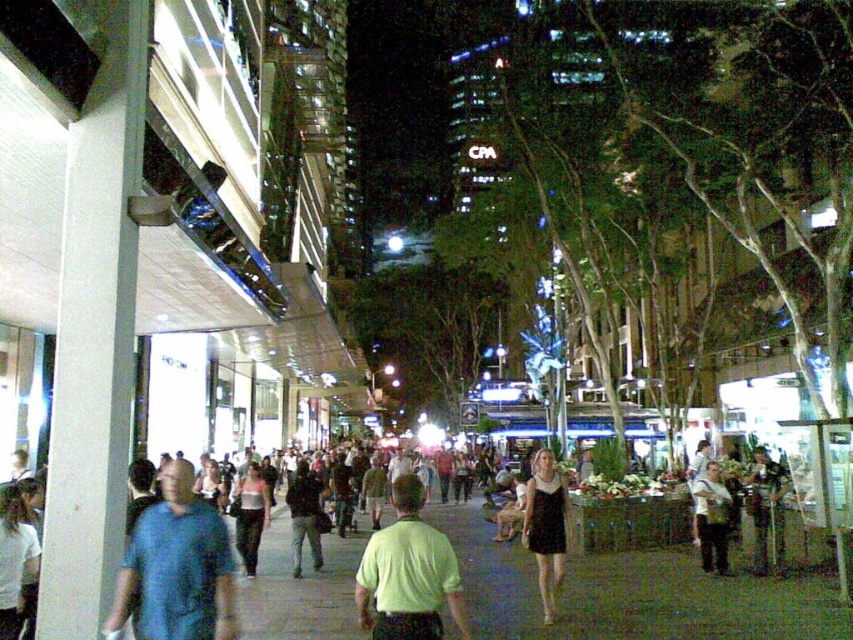
Is black dress at center shorter than light pink fabric dress at center?

In fact, black dress at center may be taller than light pink fabric dress at center.

Who is more forward, [543,461] or [247,518]?

Positioned in front is point [543,461].

The image size is (853, 640). Find the location of `black dress at center`. black dress at center is located at coordinates (546, 528).

Can you confirm if light brown leather jacket at lower right is positioned below dark gray fabric jacket at center?

Actually, light brown leather jacket at lower right is above dark gray fabric jacket at center.

In the scene shown: Is light brown leather jacket at lower right shorter than dark gray fabric jacket at center?

Yes.

Locate an element on the screen. Image resolution: width=853 pixels, height=640 pixels. light brown leather jacket at lower right is located at coordinates (712, 518).

Is smooth concrete pavement at center closer to the viewer compared to blue cotton shirt at center?

No, it is not.

Can you confirm if smooth concrete pavement at center is wider than blue cotton shirt at center?

Yes.

Does point (793, 627) lie in front of point (184, 560)?

No, (793, 627) is further to viewer.

Image resolution: width=853 pixels, height=640 pixels. I want to click on smooth concrete pavement at center, so click(631, 593).